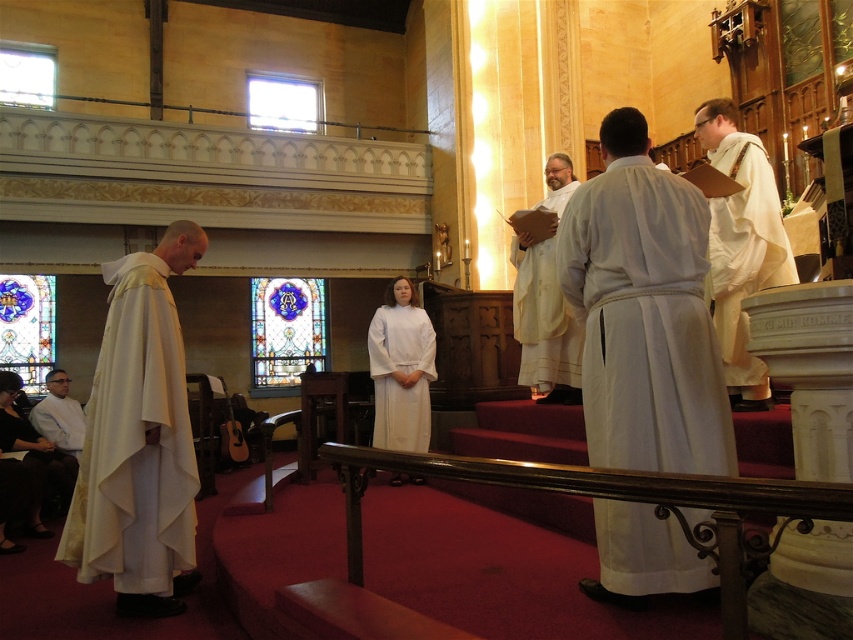
Can you confirm if white matte dress at center is positioned above stained glass window at left?

No, white matte dress at center is not above stained glass window at left.

Is white matte dress at center wider than stained glass window at left?

In fact, white matte dress at center might be narrower than stained glass window at left.

The width and height of the screenshot is (853, 640). What do you see at coordinates (403, 376) in the screenshot?
I see `white matte dress at center` at bounding box center [403, 376].

The height and width of the screenshot is (640, 853). Find the location of `white matte dress at center`. white matte dress at center is located at coordinates (403, 376).

Between white matte robe at center and stained glass window at center, which one appears on the left side from the viewer's perspective?

stained glass window at center

Is point (549, 342) closer to viewer compared to point (260, 371)?

That is True.

Find the location of `white matte robe at center`. white matte robe at center is located at coordinates (543, 320).

Which is in front, point (546, 257) or point (64, 465)?

Point (546, 257)

Does white matte robe at center appear over white clothed man at lower left?

Yes, white matte robe at center is above white clothed man at lower left.

The image size is (853, 640). Identify the location of white matte robe at center. (543, 320).